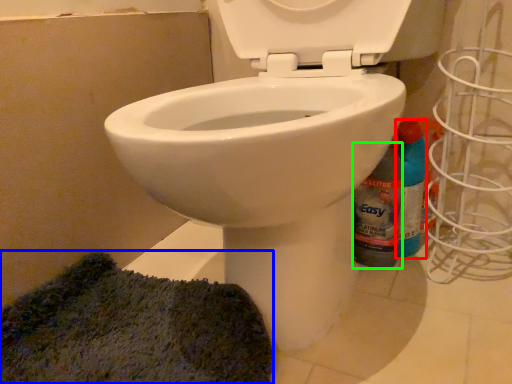
Question: Which is farther away from cleaning product (highlighted by a red box)? doormat (highlighted by a blue box) or bottle (highlighted by a green box)?

Choices:
 (A) doormat
 (B) bottle

Answer: (A)